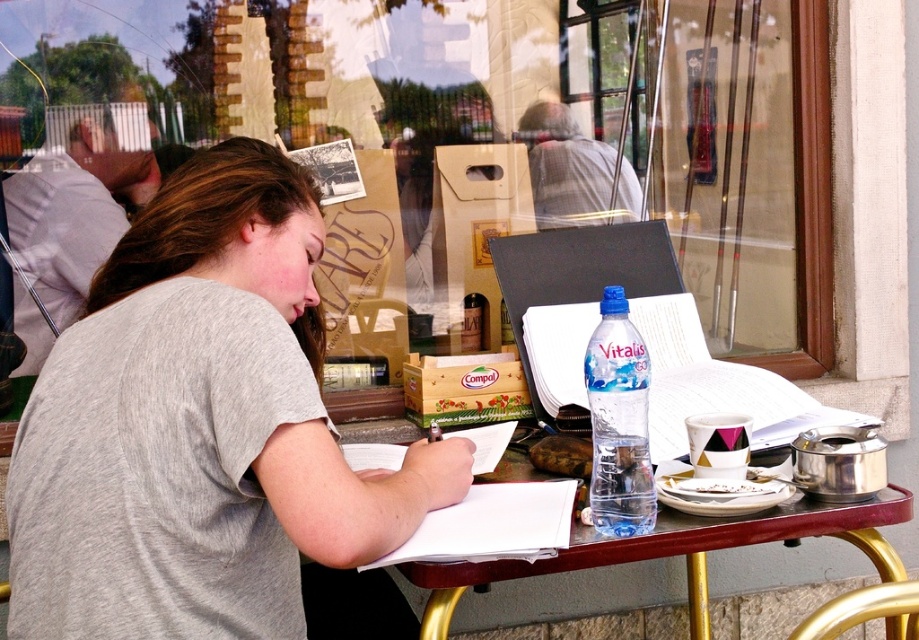
Question: Which point is closer to the camera?

Choices:
 (A) (83, 636)
 (B) (611, 296)
 (C) (852, 529)

Answer: (A)

Question: Which of the following is the farthest from the observer?

Choices:
 (A) (115, 588)
 (B) (889, 627)

Answer: (B)

Question: Which object appears closest to the camera in this image?

Choices:
 (A) wooden table at center
 (B) clear plastic bottle at center
 (C) gray cotton shirt at center

Answer: (C)

Question: In this image, where is gray cotton shirt at center located relative to wooden table at center?

Choices:
 (A) below
 (B) above

Answer: (B)

Question: Does wooden table at center appear under clear plastic bottle at center?

Choices:
 (A) yes
 (B) no

Answer: (A)

Question: Does gray cotton shirt at center appear on the left side of wooden table at center?

Choices:
 (A) no
 (B) yes

Answer: (B)